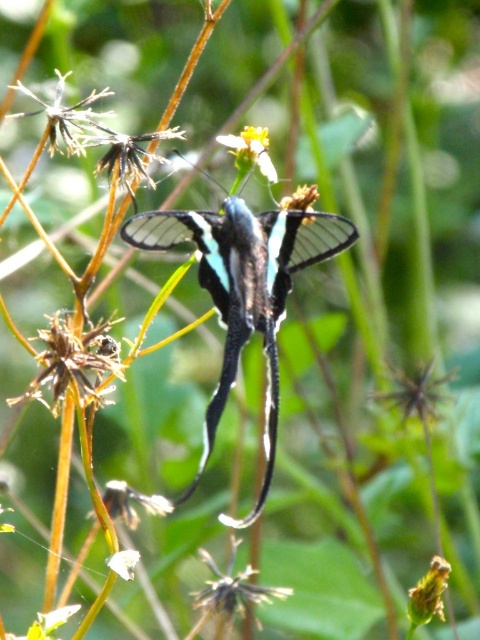
Question: Does translucent glass butterfly at center have a lesser width compared to green matte flower at lower right?

Choices:
 (A) no
 (B) yes

Answer: (A)

Question: Estimate the real-world distances between objects in this image. Which object is closer to the yellow matte flower at center?

Choices:
 (A) green matte flower at lower right
 (B) translucent glass butterfly at center

Answer: (B)

Question: Among these points, which one is nearest to the camera?

Choices:
 (A) (24, 84)
 (B) (240, 148)
 (C) (411, 611)

Answer: (C)

Question: Is translucent glass butterfly at center in front of green matte flower at lower right?

Choices:
 (A) yes
 (B) no

Answer: (A)

Question: Which is nearer to the brown dried seed head at upper left?

Choices:
 (A) green matte flower at lower right
 (B) translucent glass butterfly at center
 (C) yellow matte flower at center

Answer: (B)

Question: Where is brown dried seed head at upper left located in relation to yellow matte flower at center in the image?

Choices:
 (A) left
 (B) right

Answer: (A)